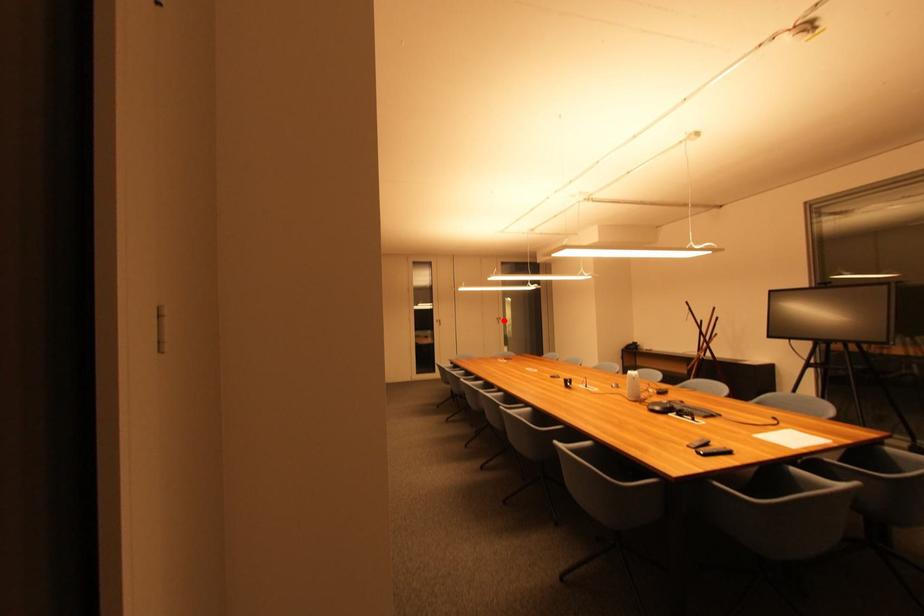
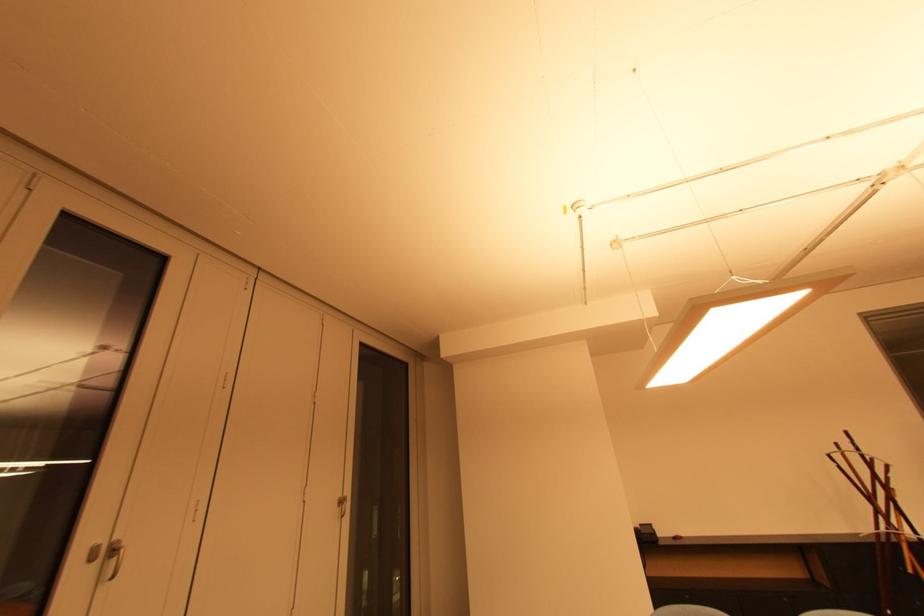
Where in the second image is the point corresponding to the highlighted location from the first image?

(346, 504)